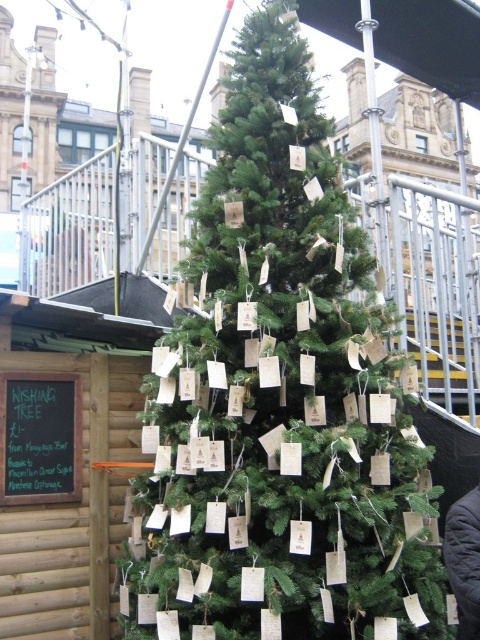
From the picture: Can you confirm if green matte christmas tree at center is thinner than black chalkboard at left?

No, green matte christmas tree at center is not thinner than black chalkboard at left.

Is green matte christmas tree at center above black chalkboard at left?

Indeed, green matte christmas tree at center is positioned over black chalkboard at left.

Where is `green matte christmas tree at center`? green matte christmas tree at center is located at coordinates (279, 400).